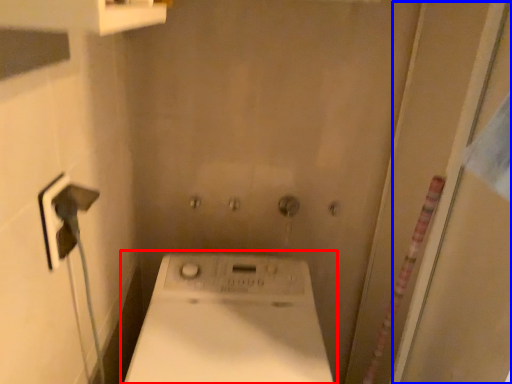
Question: Among these objects, which one is farthest to the camera, washing machine (highlighted by a red box) or screen door (highlighted by a blue box)?

Choices:
 (A) washing machine
 (B) screen door

Answer: (A)